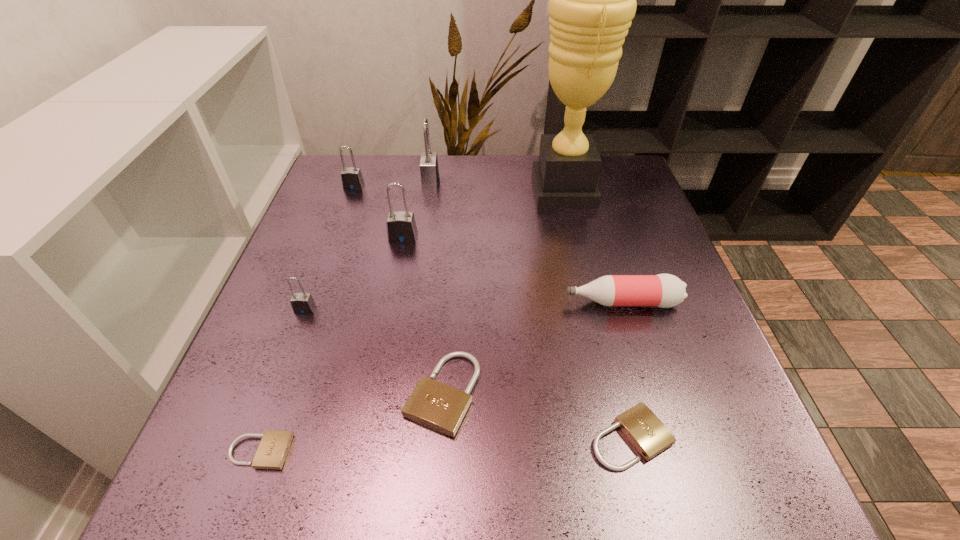
What are the coordinates of `the sixth tallest object` in the screenshot? It's located at (663, 290).

Locate an element on the screen. The height and width of the screenshot is (540, 960). bottle is located at coordinates (663, 290).

Locate an element on the screen. the seventh tallest object is located at coordinates (438, 406).

Locate an element on the screen. the third shortest padlock is located at coordinates (438, 406).

You are a GUI agent. You are given a task and a screenshot of the screen. Output one action in this format:
    pyautogui.click(x=<x>, y=<y>)
    Task: Click on the rightmost padlock
    
    Given the screenshot: What is the action you would take?
    pyautogui.click(x=646, y=432)

What are the coordinates of `the second biggest beige padlock` in the screenshot? It's located at (646, 432).

At what (x,y) coordinates should I click in order to perform the action: click on the leftmost beige padlock. Please return your answer as a coordinate pair (x, y). Looking at the image, I should click on (272, 451).

Image resolution: width=960 pixels, height=540 pixels. I want to click on the shortest padlock, so click(272, 451).

Locate an element on the screen. free space located at the front of the tallest object with handles is located at coordinates (384, 190).

This screenshot has width=960, height=540. Identify the location of free space located 0.140m at the front of the tallest object with handles. (478, 190).